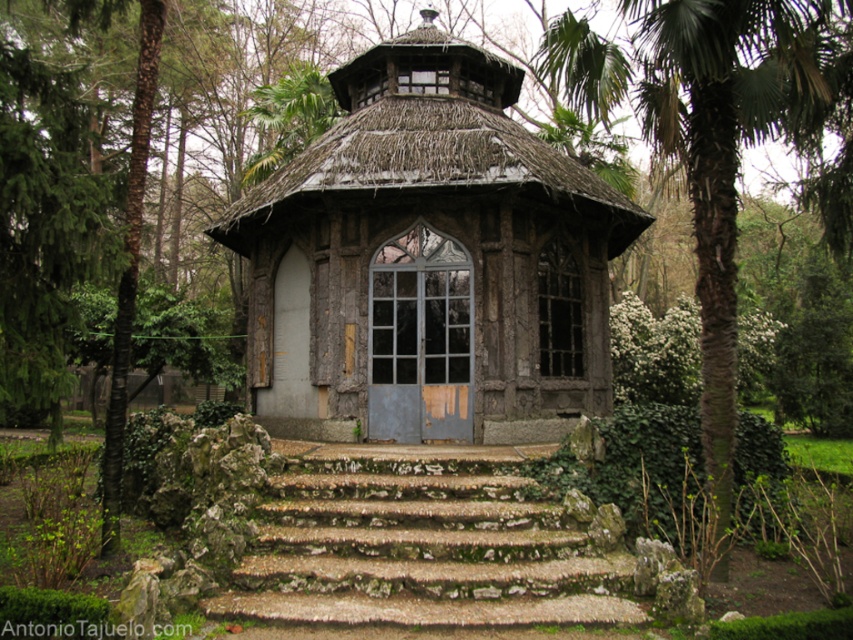
Between rustic wood gazebo at center and moss-covered stone stairs at center, which one is positioned lower?

moss-covered stone stairs at center is lower down.

The height and width of the screenshot is (640, 853). Find the location of `rustic wood gazebo at center`. rustic wood gazebo at center is located at coordinates (428, 260).

Does rustic wood gazebo at center have a greater height compared to green leafy palm tree at right?

Incorrect, rustic wood gazebo at center's height is not larger of green leafy palm tree at right's.

Is rustic wood gazebo at center positioned in front of green leafy palm tree at right?

No, rustic wood gazebo at center is behind green leafy palm tree at right.

Is point (276, 220) positioned before point (677, 10)?

No, it is behind (677, 10).

Find the location of a particular element. rustic wood gazebo at center is located at coordinates (428, 260).

Can you confirm if moss-covered stone stairs at center is bigger than green leafy palm tree at right?

Yes.

This screenshot has width=853, height=640. Describe the element at coordinates (421, 547) in the screenshot. I see `moss-covered stone stairs at center` at that location.

Identify the location of moss-covered stone stairs at center. (421, 547).